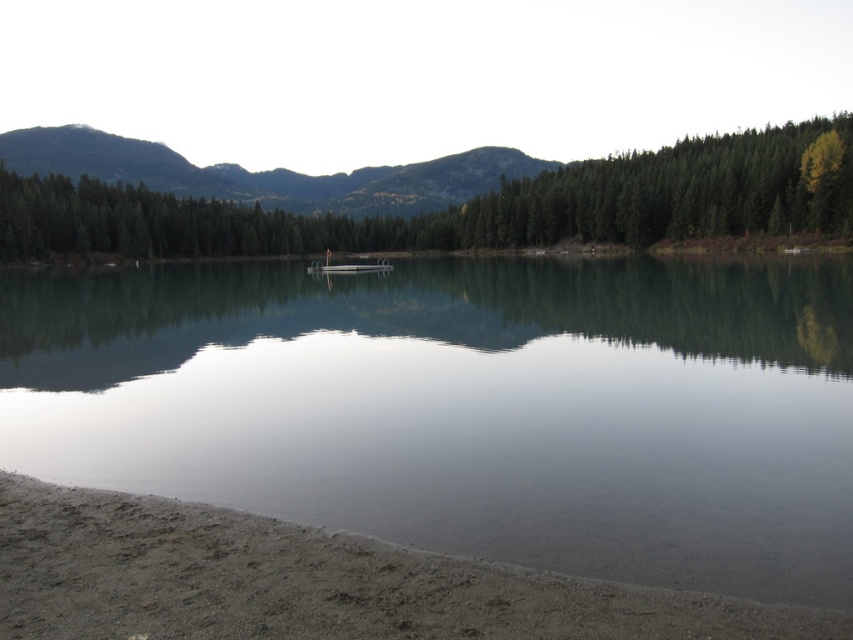
You are standing on the lakeside and want to compare the widths of the green reflective water at center and the green forested mountain at upper left. Which one appears narrower?

The green reflective water at center appears narrower than the green forested mountain at upper left because it has a lesser width according to the description.

You are standing at the lakeside and want to take a photo of the point at coordinates (785, 428). The camera you have can focus on objects up to 25 meters away. Will the point be in focus?

The point at coordinates (785, 428) is 20.61 meters from the camera, which is within the camera focus range of 25 meters. Therefore, the point will be in focus.

You are standing on the lakeshore and notice two landmarks in the scene. The first is the green reflective water at center, and the second is the green forested mountain at upper left. From your position, which of these two landmarks is positioned to the left?

The green forested mountain at upper left is positioned to the left of the green reflective water at center.